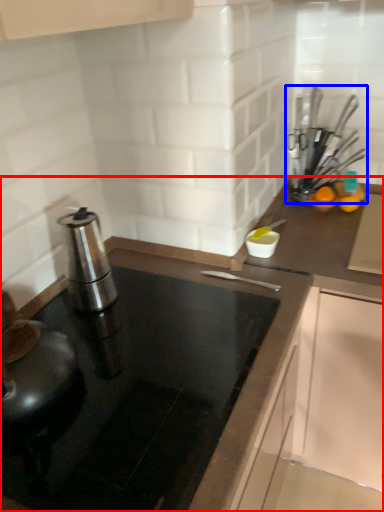
Question: Which object appears closest to the camera in this image, countertop (highlighted by a red box) or kitchen appliance (highlighted by a blue box)?

Choices:
 (A) countertop
 (B) kitchen appliance

Answer: (A)